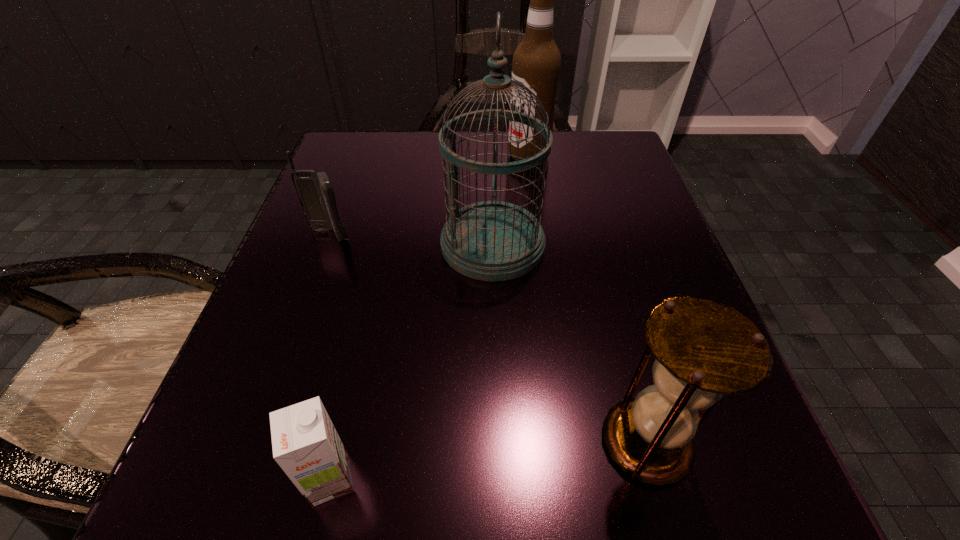
The image size is (960, 540). Find the location of `vacant space in between the birdcage and the leftmost object`. vacant space in between the birdcage and the leftmost object is located at coordinates (411, 240).

Identify the location of empty space that is in between the leftmost object and the fourth object from right to left. The image size is (960, 540). (330, 357).

Identify the location of free point between the fourth object from right to left and the farthest object. This screenshot has width=960, height=540. (429, 317).

The image size is (960, 540). I want to click on free space between the leftmost object and the farthest object, so click(x=429, y=195).

Locate an element on the screen. The image size is (960, 540). empty location between the leftmost object and the alcohol is located at coordinates (429, 195).

This screenshot has width=960, height=540. Identify the location of free spot between the hourglass and the farthest object. (588, 299).

Locate an element on the screen. The width and height of the screenshot is (960, 540). unoccupied area between the fourth object from right to left and the hourglass is located at coordinates click(489, 461).

You are a GUI agent. You are given a task and a screenshot of the screen. Output one action in this format:
    pyautogui.click(x=<x>, y=<y>)
    Task: Click on the vacant area between the second object from left to right and the farthest object
    The image size is (960, 540).
    Given the screenshot: What is the action you would take?
    pyautogui.click(x=429, y=317)

Choose which object is the fourth nearest neighbor to the second object from left to right. Please provide its 2D coordinates. Your answer should be formatted as a tuple, i.e. [(x, y)], where the tuple contains the x and y coordinates of a point satisfying the conditions above.

[(536, 63)]

Identify which object is located as the second nearest to the birdcage. Please provide its 2D coordinates. Your answer should be formatted as a tuple, i.e. [(x, y)], where the tuple contains the x and y coordinates of a point satisfying the conditions above.

[(315, 191)]